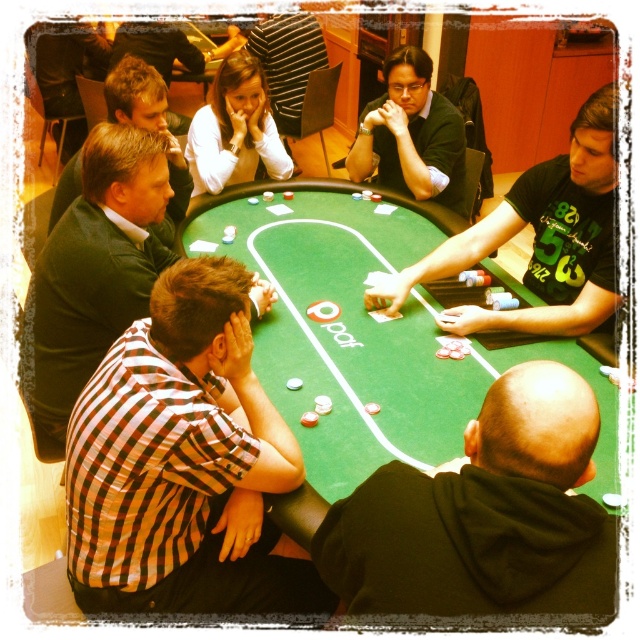
Question: Can you confirm if green felt table at center is positioned above green jersey at center?

Choices:
 (A) yes
 (B) no

Answer: (B)

Question: Does green jersey at center appear on the left side of dark brown leather jacket at upper center?

Choices:
 (A) no
 (B) yes

Answer: (A)

Question: Which point is closer to the camera taking this photo?

Choices:
 (A) (116, 72)
 (B) (124, 140)
 (C) (372, 118)
 (D) (458, 604)

Answer: (D)

Question: Which of the following is the farthest from the observer?

Choices:
 (A) (449, 156)
 (B) (202, 61)
 (C) (116, 148)

Answer: (B)

Question: Which is nearer to the dark brown leather jacket at upper center?

Choices:
 (A) matte black shirt at center
 (B) checkered fabric shirt at lower left

Answer: (A)

Question: Can you confirm if matte black shirt at center is smaller than dark brown leather jacket at upper center?

Choices:
 (A) yes
 (B) no

Answer: (B)